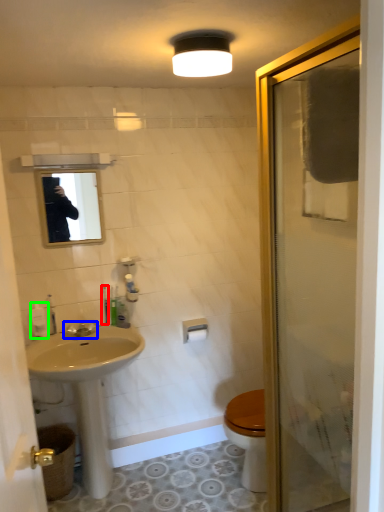
Question: Estimate the real-world distances between objects in this image. Which object is closer to toiletry (highlighted by a red box), tap (highlighted by a blue box) or toiletry (highlighted by a green box)?

Choices:
 (A) tap
 (B) toiletry

Answer: (A)